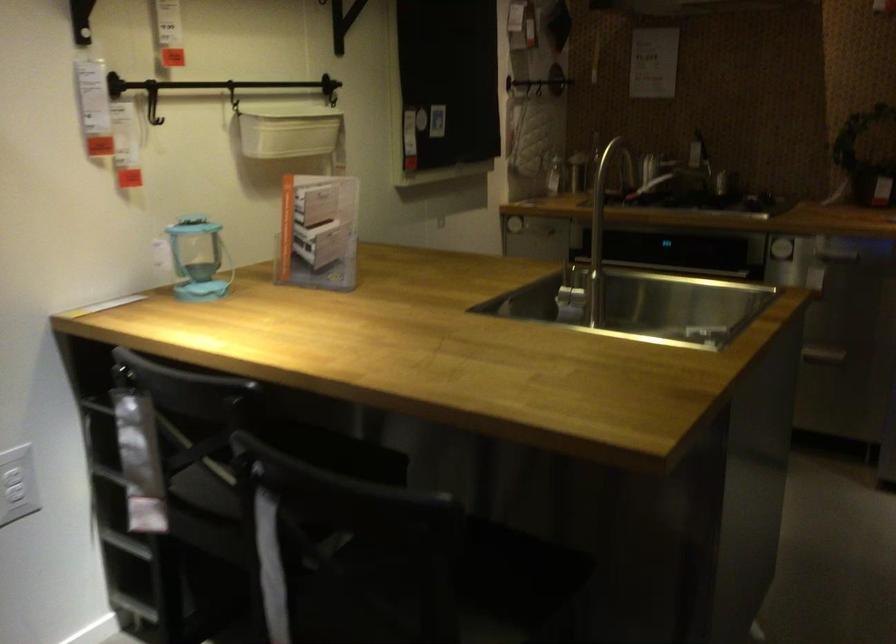
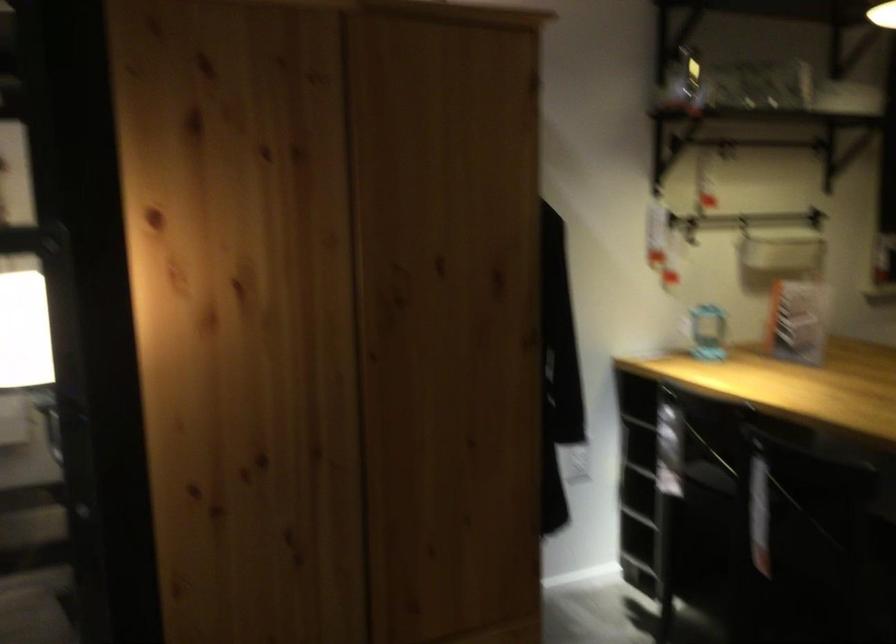
Find the pixel in the second image that matches point 202,117 in the first image.

(744, 225)